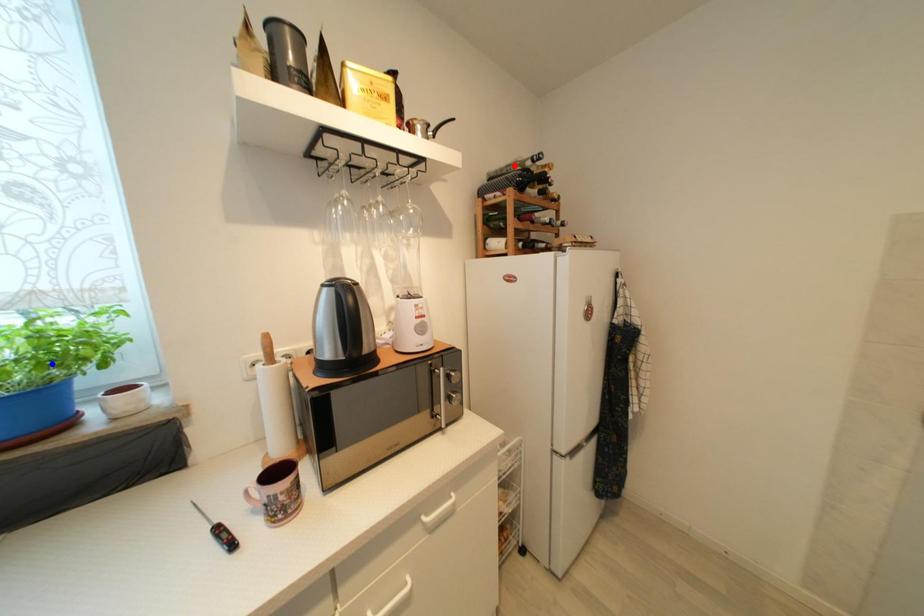
Question: Two points are marked on the image. Which point is closer to the camera?

Choices:
 (A) Blue point is closer.
 (B) Red point is closer.

Answer: (A)